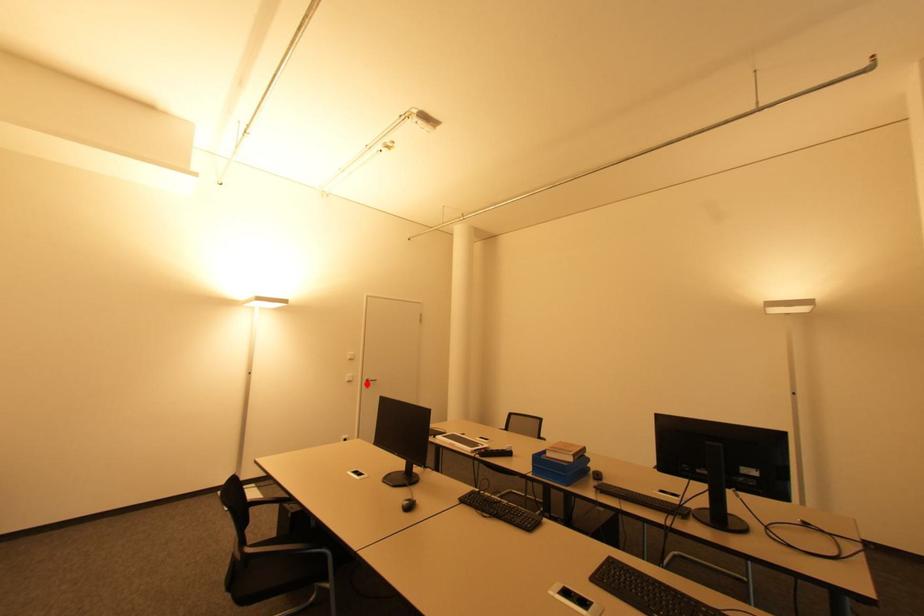
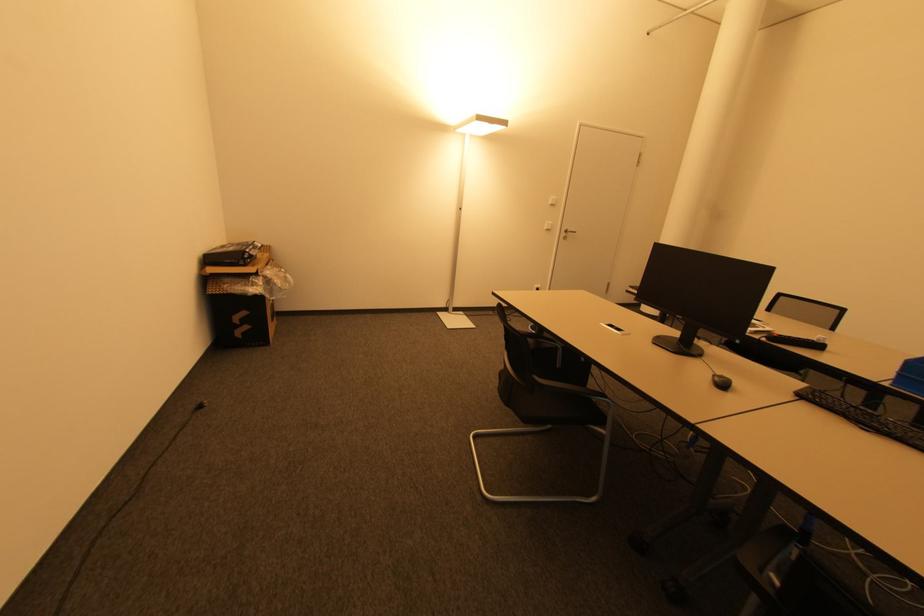
Question: A red point is marked in image1. In image2, is the corresponding 3D point closer to the camera or farther? Reply with the corresponding letter.

Choices:
 (A) The corresponding 3D point is closer.
 (B) The corresponding 3D point is farther.

Answer: (A)